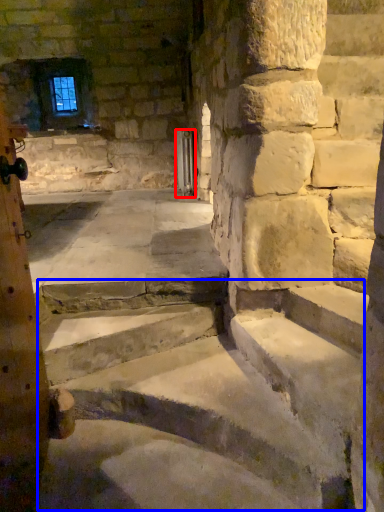
Question: Which of the following is the closest to the observer, door (highlighted by a red box) or stairwell (highlighted by a blue box)?

Choices:
 (A) door
 (B) stairwell

Answer: (B)